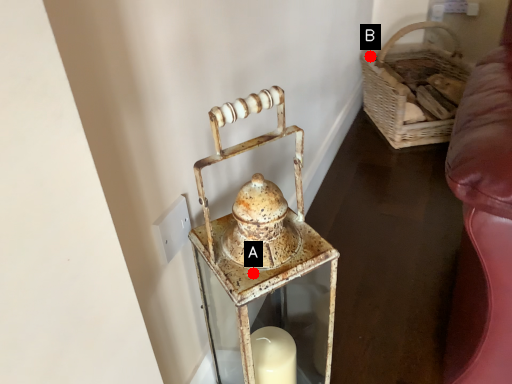
Question: Two points are circled on the image, labeled by A and B beside each circle. Which point is closer to the camera?

Choices:
 (A) A is closer
 (B) B is closer

Answer: (A)